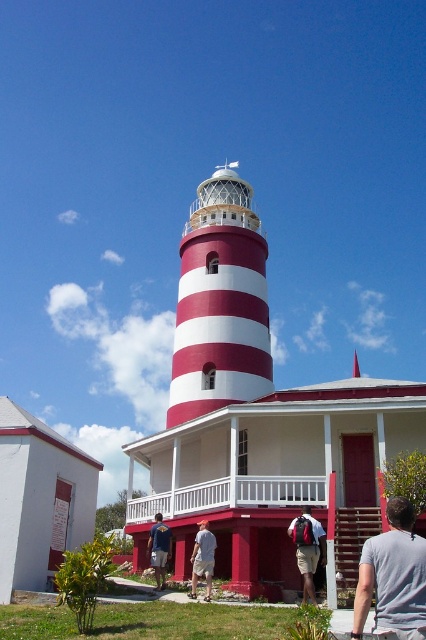
Question: Which object appears farthest from the camera in this image?

Choices:
 (A) gray cotton t-shirt at center
 (B) blue denim shorts at lower center

Answer: (B)

Question: Based on their relative distances, which object is nearer to the blue denim shorts at lower center?

Choices:
 (A) matte black backpack at lower center
 (B) white cotton shirt at center
 (C) gray cotton t-shirt at center

Answer: (B)

Question: Is gray cotton t-shirt at center smaller than matte black backpack at lower center?

Choices:
 (A) no
 (B) yes

Answer: (B)

Question: Does gray cotton t-shirt at center appear on the right side of blue denim shorts at lower center?

Choices:
 (A) no
 (B) yes

Answer: (B)

Question: Does matte black backpack at lower center have a larger size compared to blue denim shorts at lower center?

Choices:
 (A) no
 (B) yes

Answer: (B)

Question: Which point appears farthest from the camera in this image?

Choices:
 (A) (313, 588)
 (B) (152, 547)
 (C) (414, 582)

Answer: (B)